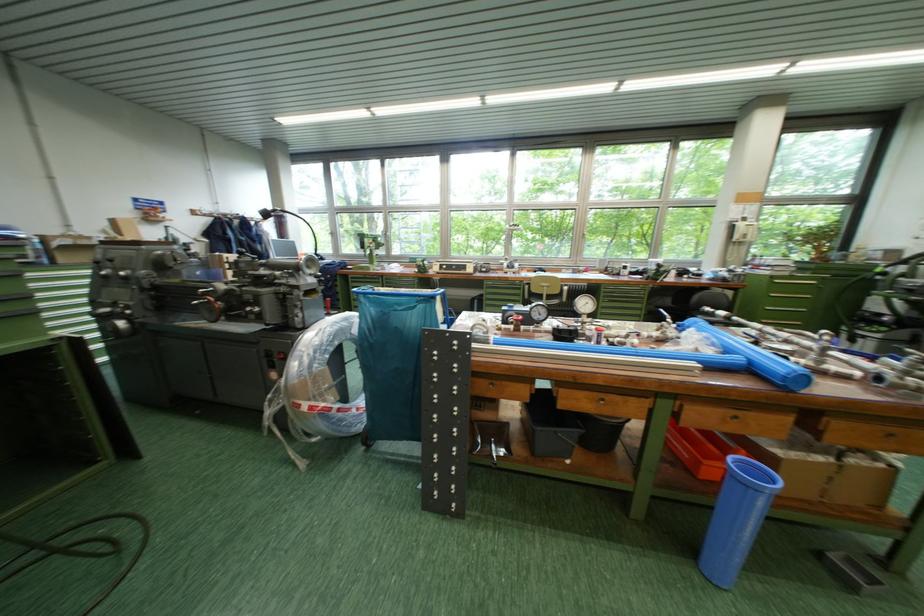
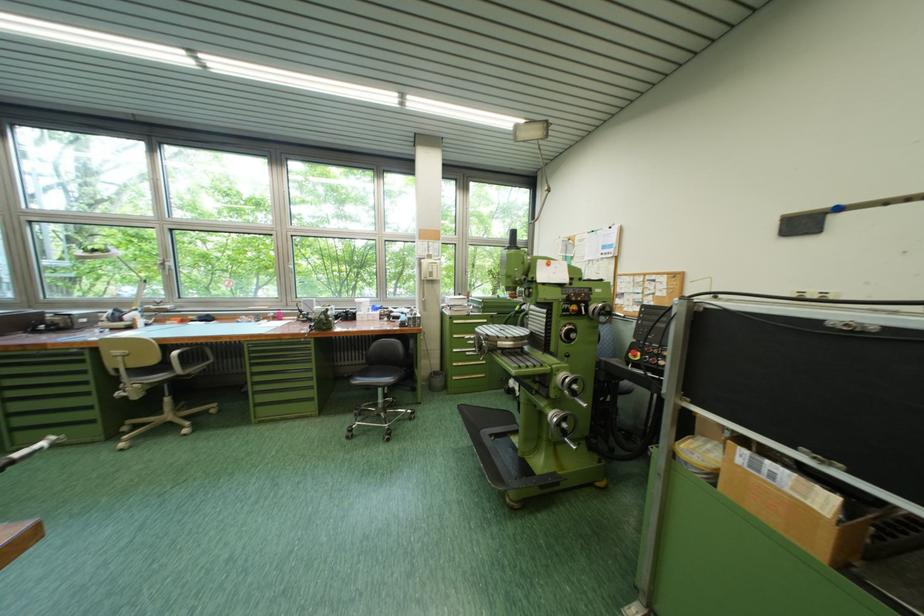
Question: Which direction would the cameraman need to move to produce the second image? Reply with the corresponding letter.

Choices:
 (A) Left
 (B) Right
 (C) Forward
 (D) Backward

Answer: (B)